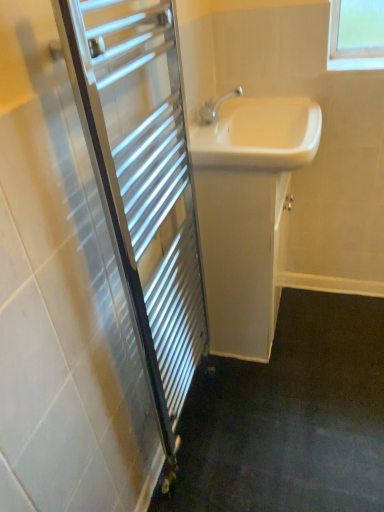
What do you see at coordinates (247, 212) in the screenshot?
I see `white glossy cabinet at center` at bounding box center [247, 212].

Describe the element at coordinates (258, 135) in the screenshot. I see `white glossy sink at center` at that location.

The width and height of the screenshot is (384, 512). I want to click on chrome metallic towel rack at left, so click(145, 180).

From a real-world perspective, which is physically below, chrome metallic towel rack at left or white glossy cabinet at center?

white glossy cabinet at center.

Considering the points (116, 187) and (282, 100), which point is behind, point (116, 187) or point (282, 100)?

The point (282, 100) is behind.

Can you tell me how much chrome metallic towel rack at left and white glossy cabinet at center differ in facing direction?

0.784 degrees.

Who is taller, chrome metallic towel rack at left or white glossy cabinet at center?

With more height is chrome metallic towel rack at left.

Image resolution: width=384 pixels, height=512 pixels. I want to click on bathroom cabinet behind the white glossy sink at center, so click(x=247, y=212).

Would you say white glossy sink at center contains white glossy cabinet at center?

Actually, white glossy cabinet at center is outside white glossy sink at center.

In the scene shown: Looking at the image, does white glossy sink at center seem bigger or smaller compared to white glossy cabinet at center?

Clearly, white glossy sink at center is smaller in size than white glossy cabinet at center.

Does white glossy sink at center lie behind white glossy cabinet at center?

No, white glossy sink at center is in front of white glossy cabinet at center.

Is point (290, 101) closer to viewer compared to point (185, 155)?

No, (290, 101) is further to viewer.

Consider the image. Would you say white glossy sink at center is outside chrome metallic towel rack at left?

Yes, white glossy sink at center is located beyond the bounds of chrome metallic towel rack at left.

Which is behind, white glossy sink at center or chrome metallic towel rack at left?

white glossy sink at center.

Is white glossy cabinet at center facing towards chrome metallic towel rack at left?

No, white glossy cabinet at center is not turned towards chrome metallic towel rack at left.

From a real-world perspective, is white glossy cabinet at center physically located above or below chrome metallic towel rack at left?

From a real-world perspective, white glossy cabinet at center is physically below chrome metallic towel rack at left.

Considering the relative sizes of white glossy cabinet at center and chrome metallic towel rack at left in the image provided, is white glossy cabinet at center shorter than chrome metallic towel rack at left?

Yes.

At what (x,y) coordinates should I click in order to perform the action: click on bathroom cabinet below the chrome metallic towel rack at left (from a real-world perspective). Please return your answer as a coordinate pair (x, y). This screenshot has height=512, width=384. Looking at the image, I should click on coord(247,212).

Between chrome metallic towel rack at left and white glossy sink at center, which one appears on the right side from the viewer's perspective?

white glossy sink at center is more to the right.

Are chrome metallic towel rack at left and white glossy sink at center far apart?

Actually, chrome metallic towel rack at left and white glossy sink at center are a little close together.

Can you confirm if chrome metallic towel rack at left is shorter than white glossy sink at center?

No, chrome metallic towel rack at left is not shorter than white glossy sink at center.

Considering the relative positions of chrome metallic towel rack at left and white glossy sink at center in the image provided, is chrome metallic towel rack at left in front of white glossy sink at center?

Yes.

Where is `bathroom cabinet that appears on the left of white glossy sink at center`? The width and height of the screenshot is (384, 512). bathroom cabinet that appears on the left of white glossy sink at center is located at coordinates (247, 212).

Does point (261, 188) appear closer or farther from the camera than point (201, 126)?

Clearly, point (261, 188) is closer to the camera than point (201, 126).

Considering the relative positions of white glossy cabinet at center and white glossy sink at center in the image provided, is white glossy cabinet at center to the left of white glossy sink at center from the viewer's perspective?

Correct, you'll find white glossy cabinet at center to the left of white glossy sink at center.

Between white glossy cabinet at center and white glossy sink at center, which one is positioned in front?

white glossy sink at center is closer to the camera.

In order to click on screen door below the white glossy cabinet at center (from the image's perspective) in this screenshot , I will do `click(145, 180)`.

Find the location of a particular element. The height and width of the screenshot is (512, 384). sink in front of the white glossy cabinet at center is located at coordinates (258, 135).

From the image, which object appears to be farther from white glossy cabinet at center, white glossy sink at center or chrome metallic towel rack at left?

The object further to white glossy cabinet at center is chrome metallic towel rack at left.

Considering their positions, is chrome metallic towel rack at left positioned closer to white glossy cabinet at center than white glossy sink at center?

white glossy sink at center is closer to white glossy cabinet at center.

Based on their spatial positions, is white glossy cabinet at center or white glossy sink at center closer to chrome metallic towel rack at left?

white glossy cabinet at center is positioned closer to the anchor chrome metallic towel rack at left.

From the image, which object appears to be farther from white glossy sink at center, chrome metallic towel rack at left or white glossy cabinet at center?

chrome metallic towel rack at left.

When comparing their distances from chrome metallic towel rack at left, does white glossy sink at center or white glossy cabinet at center seem closer?

The object closer to chrome metallic towel rack at left is white glossy cabinet at center.

Which object lies nearer to the anchor point white glossy sink at center, white glossy cabinet at center or chrome metallic towel rack at left?

white glossy cabinet at center is closer to white glossy sink at center.

Identify the location of sink between chrome metallic towel rack at left and white glossy cabinet at center from front to back. This screenshot has width=384, height=512. (258, 135).